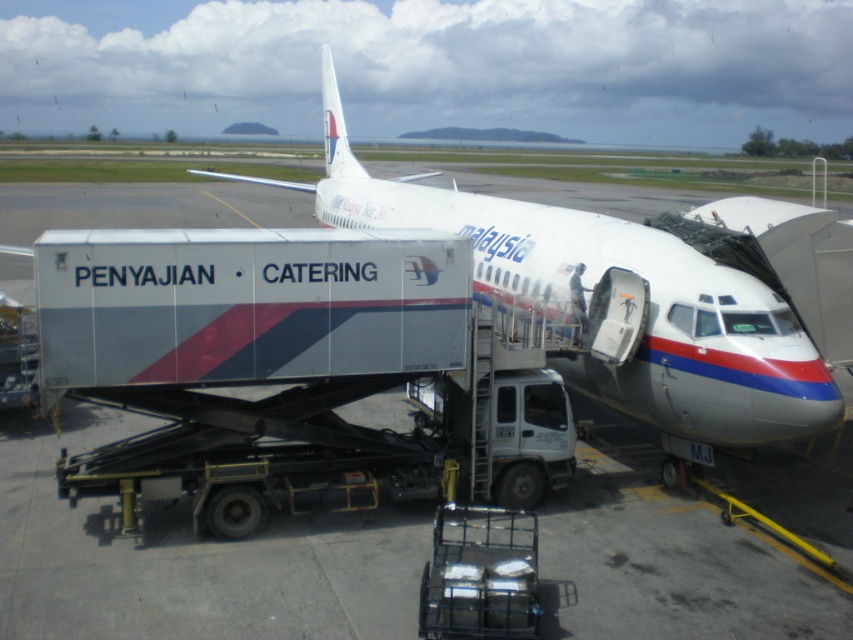
Question: Does white glossy catering truck at center appear on the right side of white glossy airplane at center?

Choices:
 (A) yes
 (B) no

Answer: (A)

Question: Among these objects, which one is nearest to the camera?

Choices:
 (A) white glossy airplane at center
 (B) white glossy catering truck at center

Answer: (B)

Question: Is white glossy catering truck at center bigger than white glossy airplane at center?

Choices:
 (A) no
 (B) yes

Answer: (A)

Question: Which of the following is the closest to the observer?

Choices:
 (A) white glossy airplane at center
 (B) white glossy catering truck at center

Answer: (B)

Question: Can you confirm if white glossy catering truck at center is wider than white glossy airplane at center?

Choices:
 (A) no
 (B) yes

Answer: (B)